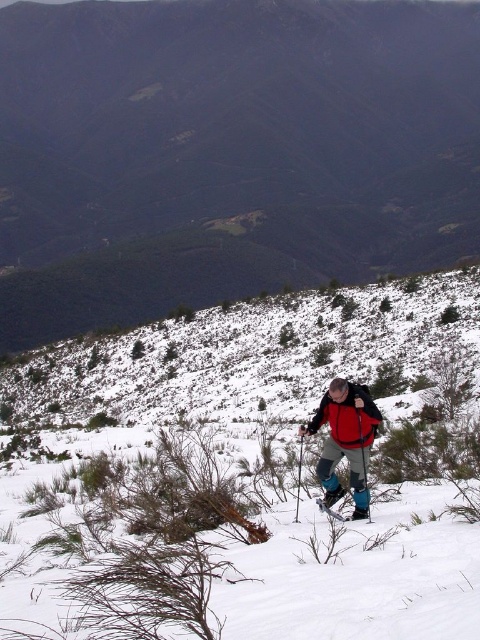
Between snowy mountain at center and white snow at center, which one is positioned lower?

white snow at center is below.

Is snowy mountain at center taller than white snow at center?

Yes.

Between point (349, 65) and point (220, 600), which one is positioned behind?

Positioned behind is point (349, 65).

Identify the location of snowy mountain at center. (228, 152).

Is the position of red fleece jacket at center less distant than that of black plastic ski pole at lower center?

Yes, red fleece jacket at center is in front of black plastic ski pole at lower center.

Does red fleece jacket at center appear over black plastic ski pole at lower center?

Indeed, red fleece jacket at center is positioned over black plastic ski pole at lower center.

Where is `red fleece jacket at center`? The width and height of the screenshot is (480, 640). red fleece jacket at center is located at coordinates (348, 417).

Is red fleece jacket at center to the left of matte black ski pole at center from the viewer's perspective?

Indeed, red fleece jacket at center is positioned on the left side of matte black ski pole at center.

Is point (370, 406) closer to camera compared to point (370, 516)?

That is True.

The width and height of the screenshot is (480, 640). Identify the location of red fleece jacket at center. (348, 417).